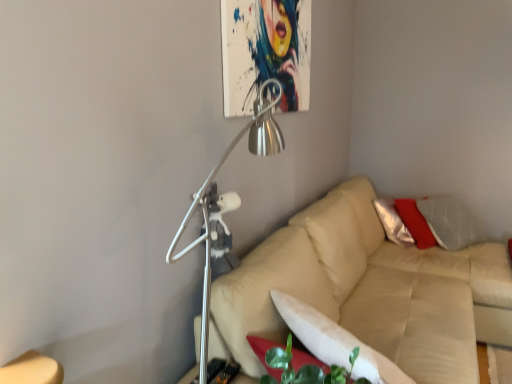
Find the location of `white soft pillow at lower center`. white soft pillow at lower center is located at coordinates (335, 342).

This screenshot has height=384, width=512. In order to click on beige leather couch at center in this screenshot , I will do `click(364, 295)`.

Is beige leather couch at center taller or shorter than metallic silver lamp at upper center?

Considering their sizes, beige leather couch at center has less height than metallic silver lamp at upper center.

Is beige leather couch at center with metallic silver lamp at upper center?

beige leather couch at center and metallic silver lamp at upper center are clearly separated.

Does beige leather couch at center have a smaller size compared to metallic silver lamp at upper center?

No.

Where is `studio couch below the metallic silver lamp at upper center (from the image's perspective)`? The image size is (512, 384). studio couch below the metallic silver lamp at upper center (from the image's perspective) is located at coordinates (364, 295).

Considering the relative sizes of white soft pillow at lower center and metallic silver lamp at upper center in the image provided, is white soft pillow at lower center wider than metallic silver lamp at upper center?

Correct, the width of white soft pillow at lower center exceeds that of metallic silver lamp at upper center.

Can you tell me how much white soft pillow at lower center and metallic silver lamp at upper center differ in facing direction?

0.78 degrees separate the facing orientations of white soft pillow at lower center and metallic silver lamp at upper center.

The image size is (512, 384). I want to click on pillow below the metallic silver lamp at upper center (from the image's perspective), so click(x=335, y=342).

Considering the relative sizes of white soft pillow at lower center and metallic silver lamp at upper center in the image provided, is white soft pillow at lower center shorter than metallic silver lamp at upper center?

Correct, white soft pillow at lower center is not as tall as metallic silver lamp at upper center.

Which is in front, metallic silver lamp at upper center or white soft pillow at lower center?

metallic silver lamp at upper center is in front.

From a real-world perspective, is metallic silver lamp at upper center physically below white soft pillow at lower center?

No, from a real-world perspective, metallic silver lamp at upper center is not under white soft pillow at lower center.

In the image, is metallic silver lamp at upper center on the left side or the right side of white soft pillow at lower center?

metallic silver lamp at upper center is to the left of white soft pillow at lower center.

Would you say metallic silver lamp at upper center is outside white soft pillow at lower center?

metallic silver lamp at upper center is positioned outside white soft pillow at lower center.

Based on the photo, from a real-world perspective, is beige leather couch at center beneath white soft pillow at lower center?

Correct, in the physical world, beige leather couch at center is lower than white soft pillow at lower center.

Consider the image. From the image's perspective, is beige leather couch at center above or below white soft pillow at lower center?

From the image's perspective, beige leather couch at center appears below white soft pillow at lower center.

Is beige leather couch at center oriented towards white soft pillow at lower center?

No, beige leather couch at center is not facing towards white soft pillow at lower center.

Which of these two, beige leather couch at center or white soft pillow at lower center, is bigger?

Bigger between the two is beige leather couch at center.

Between point (266, 139) and point (242, 339), which one is positioned behind?

The point (242, 339) is farther.

In the image, is metallic silver lamp at upper center on the left side or the right side of beige leather couch at center?

metallic silver lamp at upper center is to the left of beige leather couch at center.

From the image's perspective, would you say metallic silver lamp at upper center is positioned over beige leather couch at center?

Yes.

Is metallic silver lamp at upper center smaller than beige leather couch at center?

Correct, metallic silver lamp at upper center occupies less space than beige leather couch at center.

Considering the sizes of objects white soft pillow at lower center and beige leather couch at center in the image provided, who is smaller, white soft pillow at lower center or beige leather couch at center?

Smaller between the two is white soft pillow at lower center.

You are a GUI agent. You are given a task and a screenshot of the screen. Output one action in this format:
    pyautogui.click(x=<x>, y=<y>)
    Task: Click on the studio couch on the right of white soft pillow at lower center
    
    Given the screenshot: What is the action you would take?
    pyautogui.click(x=364, y=295)

Is white soft pillow at lower center in front of or behind beige leather couch at center in the image?

Visually, white soft pillow at lower center is located in front of beige leather couch at center.

Can you confirm if white soft pillow at lower center is shorter than beige leather couch at center?

Yes, white soft pillow at lower center is shorter than beige leather couch at center.

Where is `lamp on the left of beige leather couch at center`? The height and width of the screenshot is (384, 512). lamp on the left of beige leather couch at center is located at coordinates (211, 182).

Locate an element on the screen. pillow behind the metallic silver lamp at upper center is located at coordinates (335, 342).

From the image, which object appears to be nearer to beige leather couch at center, metallic silver lamp at upper center or white soft pillow at lower center?

Among the two, white soft pillow at lower center is located nearer to beige leather couch at center.

Looking at the image, which one is located closer to metallic silver lamp at upper center, white soft pillow at lower center or beige leather couch at center?

white soft pillow at lower center is positioned closer to the anchor metallic silver lamp at upper center.

From the image, which object appears to be nearer to metallic silver lamp at upper center, beige leather couch at center or white soft pillow at lower center?

Based on the image, white soft pillow at lower center appears to be nearer to metallic silver lamp at upper center.

Based on their spatial positions, is white soft pillow at lower center or metallic silver lamp at upper center further from beige leather couch at center?

metallic silver lamp at upper center is positioned further to the anchor beige leather couch at center.

Considering their positions, is beige leather couch at center positioned further to white soft pillow at lower center than metallic silver lamp at upper center?

Based on the image, beige leather couch at center appears to be further to white soft pillow at lower center.

Estimate the real-world distances between objects in this image. Which object is closer to white soft pillow at lower center, metallic silver lamp at upper center or beige leather couch at center?

Among the two, metallic silver lamp at upper center is located nearer to white soft pillow at lower center.

What are the coordinates of `pillow between metallic silver lamp at upper center and beige leather couch at center in the horizontal direction` in the screenshot? It's located at [x=335, y=342].